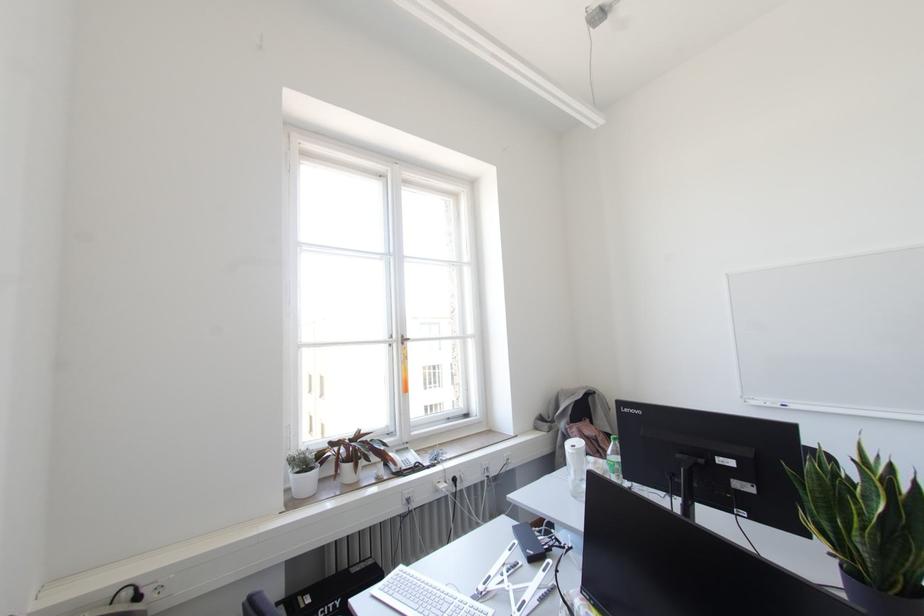
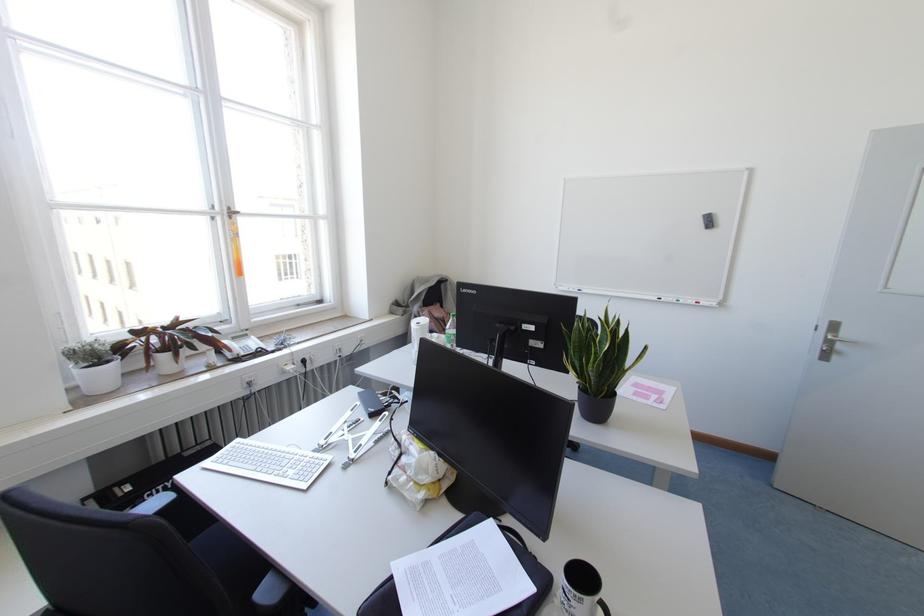
Question: What movement of the cameraman would produce the second image?

Choices:
 (A) Left
 (B) Right
 (C) Forward
 (D) Backward

Answer: (B)